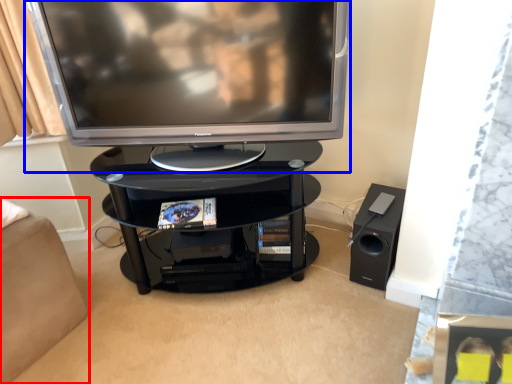
Question: Which object is closer to the camera taking this photo, furniture (highlighted by a red box) or television (highlighted by a blue box)?

Choices:
 (A) furniture
 (B) television

Answer: (B)